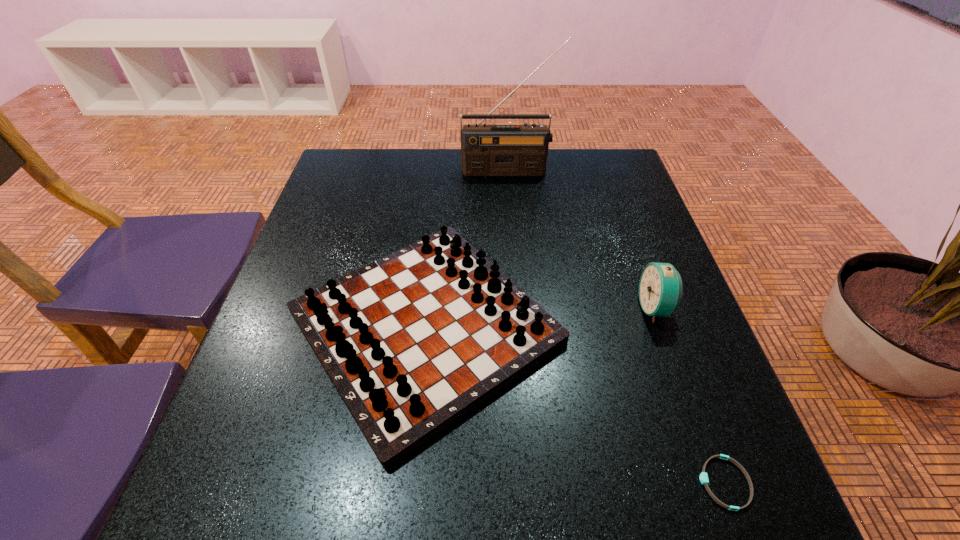
Find the location of a particular element. Image resolution: width=960 pixels, height=540 pixels. object present at the near right corner is located at coordinates (704, 480).

Identify the location of free space at the far edge of the desktop. The height and width of the screenshot is (540, 960). (425, 150).

Image resolution: width=960 pixels, height=540 pixels. I want to click on vacant region at the near edge, so click(x=491, y=513).

This screenshot has width=960, height=540. In order to click on vacant space at the left edge of the desktop in this screenshot , I will do `click(329, 253)`.

The width and height of the screenshot is (960, 540). What are the coordinates of `vacant position at the right edge of the desktop` in the screenshot? It's located at (743, 434).

Locate an element on the screen. The image size is (960, 540). vacant space at the far right corner of the desktop is located at coordinates (596, 159).

What are the coordinates of `vacant space that's between the farthest object and the wristband` in the screenshot? It's located at (616, 327).

Locate an element on the screen. This screenshot has height=540, width=960. free space between the wristband and the alarm clock is located at coordinates (690, 395).

Where is `free area in between the alarm clock and the tallest object`? free area in between the alarm clock and the tallest object is located at coordinates (582, 239).

I want to click on free space between the alarm clock and the shortest object, so click(690, 395).